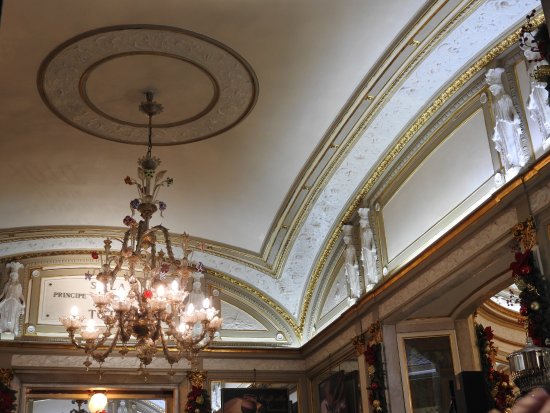
Locate an element on the screen. The image size is (550, 413). light is located at coordinates (94, 404).